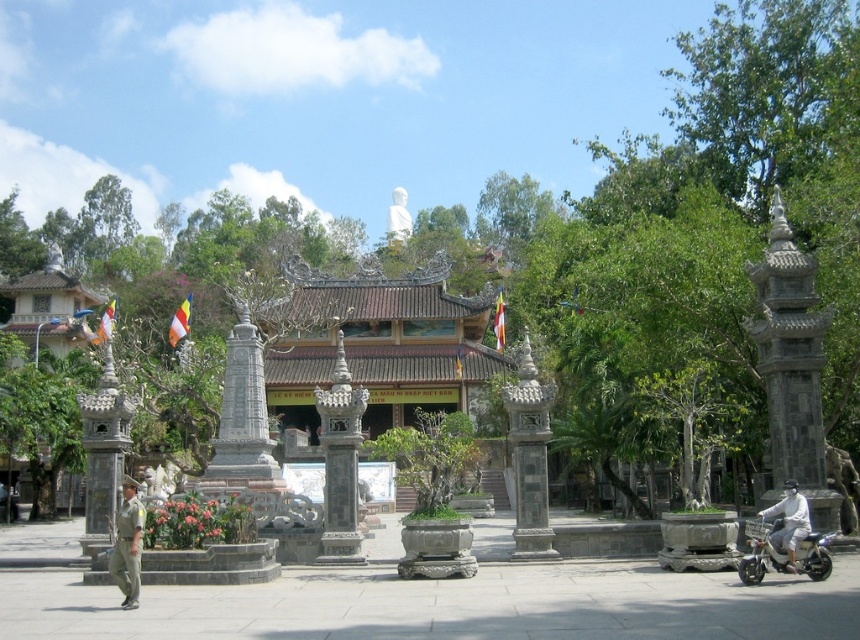
Measure the distance between point (787, 568) and camera.

Point (787, 568) is 37.20 meters from camera.

The height and width of the screenshot is (640, 860). I want to click on metallic silver scooter at lower right, so click(x=762, y=550).

Is khaki uniform at lower left taller than white matte scooter at lower right?

Yes.

Between khaki uniform at lower left and white matte scooter at lower right, which one has more height?

Standing taller between the two is khaki uniform at lower left.

Between point (136, 525) and point (793, 522), which one is positioned behind?

Positioned behind is point (793, 522).

Where is `khaki uniform at lower left`? This screenshot has height=640, width=860. khaki uniform at lower left is located at coordinates (129, 544).

Which is in front, point (447, 392) or point (120, 568)?

Point (120, 568) is more forward.

Is brown wooden palace at center to the right of khaki uniform at lower left from the viewer's perspective?

Correct, you'll find brown wooden palace at center to the right of khaki uniform at lower left.

Does point (355, 276) come in front of point (134, 522)?

No, (355, 276) is further to viewer.

The image size is (860, 640). Find the location of `brown wooden palace at center`. brown wooden palace at center is located at coordinates point(381,342).